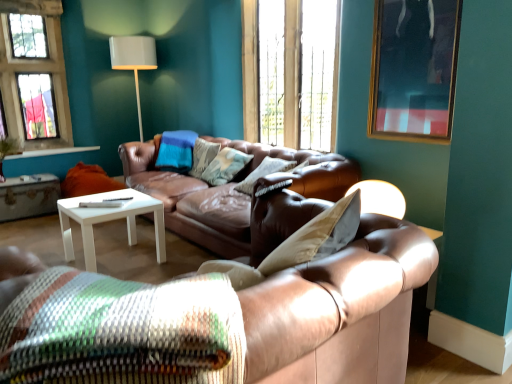
Question: Is textured beige pillow at center, the third pillow in the front-to-back sequence, wider or thinner than white wood side table at lower left?

Choices:
 (A) thin
 (B) wide

Answer: (A)

Question: From their relative heights in the image, would you say textured beige pillow at center, the first pillow viewed from the back, is taller or shorter than white wood side table at lower left?

Choices:
 (A) short
 (B) tall

Answer: (B)

Question: Which of these objects is positioned closest to the brown leather couch at center, marked as the 2th studio couch in a back-to-front arrangement?

Choices:
 (A) textured beige pillow at center, the third pillow in the front-to-back sequence
 (B) glass pane window at upper left, the second window from the right
 (C) wooden frame at upper center, positioned as the 2th window in left-to-right order
 (D) textured woven pillow at center, which is the third pillow from back to front
 (E) white wood side table at lower left

Answer: (D)

Question: Estimate the real-world distances between objects in this image. Which object is closer to the glass pane window at upper left, the 1th window from the left?

Choices:
 (A) wooden frame at upper center, which is counted as the first window, starting from the right
 (B) textured brown pillow at center, which is the second pillow from back to front
 (C) textured beige pillow at center, the third pillow in the front-to-back sequence
 (D) textured woven pillow at center, which is the third pillow from back to front
 (E) brown leather couch at center, the 1th studio couch from the front

Answer: (A)